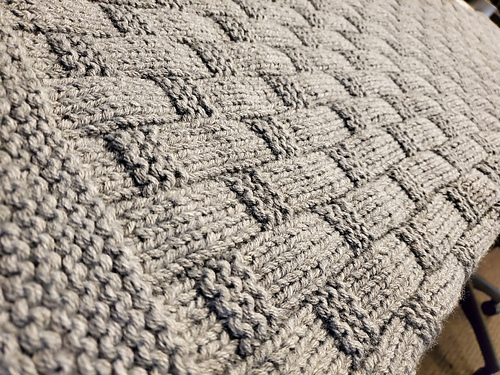
In order to click on swivel chair legs in this screenshot , I will do `click(483, 341)`, `click(486, 284)`.